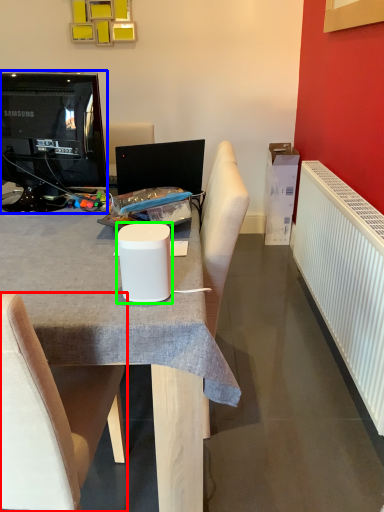
Question: Based on their relative distances, which object is nearer to chair (highlighted by a red box)? Choose from television (highlighted by a blue box) and paper cup (highlighted by a green box).

Choices:
 (A) television
 (B) paper cup

Answer: (B)